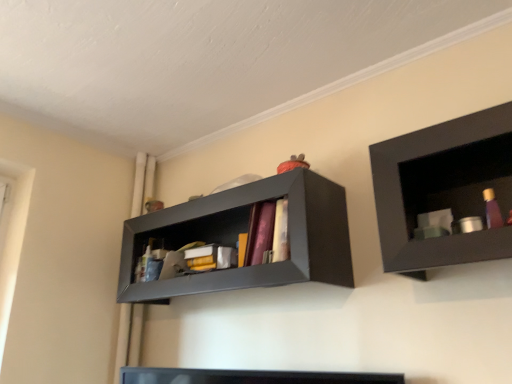
Where is `matte black shelf at upper center, the first shelf from the back`? matte black shelf at upper center, the first shelf from the back is located at coordinates (245, 232).

Image resolution: width=512 pixels, height=384 pixels. What do you see at coordinates (245, 232) in the screenshot? I see `matte black shelf at upper center, which ranks as the 2th shelf in right-to-left order` at bounding box center [245, 232].

From the picture: Measure the distance between point (315, 207) and camera.

The depth of point (315, 207) is 1.46 meters.

In order to face matte black shelf at upper center, the first shelf from the back, should I rotate leftwards or rightwards?

Rotate left and turn 4.352 degrees.

In the scene shown: Measure the distance between point (385, 181) and camera.

4.14 feet.

Image resolution: width=512 pixels, height=384 pixels. Identify the location of matte black shelf at upper right, marked as the 1th shelf in a front-to-back arrangement. (443, 190).

The width and height of the screenshot is (512, 384). What do you see at coordinates (443, 190) in the screenshot?
I see `matte black shelf at upper right, the 2th shelf in the left-to-right sequence` at bounding box center [443, 190].

How much space does matte black shelf at upper right, which is the second shelf from back to front, occupy vertically?

41.39 centimeters.

Identify the location of matte black shelf at upper center, which is the 1th shelf in left-to-right order. Image resolution: width=512 pixels, height=384 pixels. (245, 232).

Considering the relative positions of matte black shelf at upper center, which is the second shelf from front to back, and matte black shelf at upper right, marked as the 1th shelf in a front-to-back arrangement, in the image provided, is matte black shelf at upper center, which is the second shelf from front to back, to the left of matte black shelf at upper right, marked as the 1th shelf in a front-to-back arrangement, from the viewer's perspective?

Indeed, matte black shelf at upper center, which is the second shelf from front to back, is positioned on the left side of matte black shelf at upper right, marked as the 1th shelf in a front-to-back arrangement.

Considering the relative positions of matte black shelf at upper center, which is the 1th shelf in left-to-right order, and matte black shelf at upper right, marked as the 1th shelf in a front-to-back arrangement, in the image provided, is matte black shelf at upper center, which is the 1th shelf in left-to-right order, in front of matte black shelf at upper right, marked as the 1th shelf in a front-to-back arrangement,?

No, matte black shelf at upper center, which is the 1th shelf in left-to-right order, is further to the viewer.

Does point (310, 206) appear closer or farther from the camera than point (408, 233)?

Point (310, 206).

From the image's perspective, does matte black shelf at upper center, which is the second shelf from front to back, appear lower than matte black shelf at upper right, marked as the first shelf in a right-to-left arrangement?

Yes, from the image's perspective, matte black shelf at upper center, which is the second shelf from front to back, is beneath matte black shelf at upper right, marked as the first shelf in a right-to-left arrangement.

From a real-world perspective, is matte black shelf at upper center, which ranks as the 2th shelf in right-to-left order, positioned above or below matte black shelf at upper right, which is the second shelf from back to front?

Clearly, from a real-world perspective, matte black shelf at upper center, which ranks as the 2th shelf in right-to-left order, is above matte black shelf at upper right, which is the second shelf from back to front.

Is matte black shelf at upper center, which ranks as the 2th shelf in right-to-left order, wider than matte black shelf at upper right, marked as the first shelf in a right-to-left arrangement?

Indeed, matte black shelf at upper center, which ranks as the 2th shelf in right-to-left order, has a greater width compared to matte black shelf at upper right, marked as the first shelf in a right-to-left arrangement.

Considering the sizes of matte black shelf at upper center, which is the 1th shelf in left-to-right order, and matte black shelf at upper right, which is the second shelf from back to front, in the image, is matte black shelf at upper center, which is the 1th shelf in left-to-right order, taller or shorter than matte black shelf at upper right, which is the second shelf from back to front,?

matte black shelf at upper center, which is the 1th shelf in left-to-right order, is shorter than matte black shelf at upper right, which is the second shelf from back to front.

Based on their sizes in the image, would you say matte black shelf at upper center, which ranks as the 2th shelf in right-to-left order, is bigger or smaller than matte black shelf at upper right, the 2th shelf in the left-to-right sequence?

Clearly, matte black shelf at upper center, which ranks as the 2th shelf in right-to-left order, is larger in size than matte black shelf at upper right, the 2th shelf in the left-to-right sequence.

From the picture: Is matte black shelf at upper right, which is the second shelf from back to front, completely or partially inside matte black shelf at upper center, which is the 1th shelf in left-to-right order?

No, matte black shelf at upper center, which is the 1th shelf in left-to-right order, does not contain matte black shelf at upper right, which is the second shelf from back to front.

Can you see matte black shelf at upper center, which is the second shelf from front to back, touching matte black shelf at upper right, the 2th shelf in the left-to-right sequence?

No, matte black shelf at upper center, which is the second shelf from front to back, is not beside matte black shelf at upper right, the 2th shelf in the left-to-right sequence.

Is matte black shelf at upper right, the 2th shelf in the left-to-right sequence, at the back of matte black shelf at upper center, the first shelf from the back?

matte black shelf at upper center, the first shelf from the back, does not have its back to matte black shelf at upper right, the 2th shelf in the left-to-right sequence.

Measure the distance from matte black shelf at upper center, which is the second shelf from front to back, to matte black shelf at upper right, the 2th shelf in the left-to-right sequence.

A distance of 20.13 inches exists between matte black shelf at upper center, which is the second shelf from front to back, and matte black shelf at upper right, the 2th shelf in the left-to-right sequence.

You are a GUI agent. You are given a task and a screenshot of the screen. Output one action in this format:
    pyautogui.click(x=<x>, y=<y>)
    Task: Click on the shelf lying above the matte black shelf at upper center, the first shelf from the back (from the image's perspective)
    Image resolution: width=512 pixels, height=384 pixels.
    Given the screenshot: What is the action you would take?
    pyautogui.click(x=443, y=190)

Considering the positions of objects matte black shelf at upper right, the 2th shelf in the left-to-right sequence, and matte black shelf at upper center, which ranks as the 2th shelf in right-to-left order, in the image provided, who is more to the right, matte black shelf at upper right, the 2th shelf in the left-to-right sequence, or matte black shelf at upper center, which ranks as the 2th shelf in right-to-left order,?

From the viewer's perspective, matte black shelf at upper right, the 2th shelf in the left-to-right sequence, appears more on the right side.

Does matte black shelf at upper right, marked as the 1th shelf in a front-to-back arrangement, lie in front of matte black shelf at upper center, which is the 1th shelf in left-to-right order?

Yes, it is.

Considering the positions of point (448, 256) and point (264, 275), is point (448, 256) closer or farther from the camera than point (264, 275)?

Point (448, 256) is closer to the camera than point (264, 275).

In the scene shown: From the image's perspective, is matte black shelf at upper right, marked as the 1th shelf in a front-to-back arrangement, located above or below matte black shelf at upper center, which is the second shelf from front to back?

From the image's perspective, matte black shelf at upper right, marked as the 1th shelf in a front-to-back arrangement, appears above matte black shelf at upper center, which is the second shelf from front to back.

From a real-world perspective, is matte black shelf at upper right, marked as the first shelf in a right-to-left arrangement, under matte black shelf at upper center, the first shelf from the back?

Yes.

Does matte black shelf at upper right, the 2th shelf in the left-to-right sequence, have a lesser width compared to matte black shelf at upper center, which is the 1th shelf in left-to-right order?

Correct, the width of matte black shelf at upper right, the 2th shelf in the left-to-right sequence, is less than that of matte black shelf at upper center, which is the 1th shelf in left-to-right order.

Considering the sizes of objects matte black shelf at upper right, marked as the 1th shelf in a front-to-back arrangement, and matte black shelf at upper center, which ranks as the 2th shelf in right-to-left order, in the image provided, who is taller, matte black shelf at upper right, marked as the 1th shelf in a front-to-back arrangement, or matte black shelf at upper center, which ranks as the 2th shelf in right-to-left order,?

matte black shelf at upper center, which ranks as the 2th shelf in right-to-left order, is taller.

Looking at this image, who is bigger, matte black shelf at upper right, the 2th shelf in the left-to-right sequence, or matte black shelf at upper center, which ranks as the 2th shelf in right-to-left order?

With larger size is matte black shelf at upper center, which ranks as the 2th shelf in right-to-left order.

From the picture: Would you say matte black shelf at upper center, the first shelf from the back, is part of matte black shelf at upper right, the 2th shelf in the left-to-right sequence,'s contents?

No, matte black shelf at upper right, the 2th shelf in the left-to-right sequence, does not contain matte black shelf at upper center, the first shelf from the back.

Is matte black shelf at upper right, which is the second shelf from back to front, touching matte black shelf at upper center, which is the 1th shelf in left-to-right order?

No, matte black shelf at upper right, which is the second shelf from back to front, is not with matte black shelf at upper center, which is the 1th shelf in left-to-right order.

From the picture: Could you tell me if matte black shelf at upper right, which is the second shelf from back to front, is facing matte black shelf at upper center, the first shelf from the back?

No.

Where is `shelf below the matte black shelf at upper center, which is the 1th shelf in left-to-right order (from a real-world perspective)`? shelf below the matte black shelf at upper center, which is the 1th shelf in left-to-right order (from a real-world perspective) is located at coordinates (443, 190).

Locate an element on the screen. shelf in front of the matte black shelf at upper center, which is the second shelf from front to back is located at coordinates (443, 190).

The image size is (512, 384). I want to click on shelf behind the matte black shelf at upper right, the 2th shelf in the left-to-right sequence, so click(x=245, y=232).